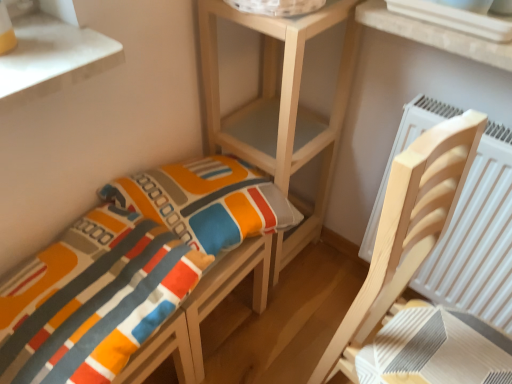
Measure the distance between textured fabric cushion at lower left, acting as the 2th furniture starting from the right, and camera.

The distance of textured fabric cushion at lower left, acting as the 2th furniture starting from the right, from camera is 29.91 inches.

Locate an element on the screen. The width and height of the screenshot is (512, 384). white plastic window at upper right is located at coordinates (434, 35).

From a real-world perspective, does white plastic window at upper right sit lower than light wood chair at right, acting as the 2th furniture starting from the left?

No.

Are white plastic window at upper right and light wood chair at right, the 1th furniture in the right-to-left sequence, located far from each other?

No, white plastic window at upper right is in close proximity to light wood chair at right, the 1th furniture in the right-to-left sequence.

Can you tell me how much white plastic window at upper right and light wood chair at right, acting as the 2th furniture starting from the left, differ in facing direction?

The angular difference between white plastic window at upper right and light wood chair at right, acting as the 2th furniture starting from the left, is 82.4 degrees.

From the picture: Which is nearer, (415, 38) or (448, 223)?

Point (415, 38) is closer to the camera than point (448, 223).

Considering the points (253, 19) and (160, 262), which point is in front, point (253, 19) or point (160, 262)?

The point (160, 262) is closer to the camera.

Can you confirm if wooden shelf at center is thinner than textured fabric cushion at lower left, the 1th furniture in the left-to-right sequence?

Indeed, wooden shelf at center has a lesser width compared to textured fabric cushion at lower left, the 1th furniture in the left-to-right sequence.

Is wooden shelf at center to the left of textured fabric cushion at lower left, the 1th furniture in the left-to-right sequence, from the viewer's perspective?

No, wooden shelf at center is not to the left of textured fabric cushion at lower left, the 1th furniture in the left-to-right sequence.

Considering the sizes of objects wooden shelf at center and white plastic window at upper right in the image provided, who is taller, wooden shelf at center or white plastic window at upper right?

wooden shelf at center is taller.

Which object is thinner, wooden shelf at center or white plastic window at upper right?

wooden shelf at center.

Image resolution: width=512 pixels, height=384 pixels. In order to click on window that appears in front of the wooden shelf at center in this screenshot , I will do `click(434, 35)`.

Considering the relative positions of wooden shelf at center and white plastic window at upper right in the image provided, is wooden shelf at center to the left of white plastic window at upper right from the viewer's perspective?

Correct, you'll find wooden shelf at center to the left of white plastic window at upper right.

Does point (450, 42) come closer to viewer compared to point (183, 167)?

Yes, it is in front of point (183, 167).

Who is smaller, white plastic window at upper right or textured fabric cushion at lower left, the 1th furniture in the left-to-right sequence?

white plastic window at upper right is smaller.

Is white plastic window at upper right shorter than textured fabric cushion at lower left, acting as the 2th furniture starting from the right?

Correct, white plastic window at upper right is not as tall as textured fabric cushion at lower left, acting as the 2th furniture starting from the right.

From a real-world perspective, relative to textured fabric cushion at lower left, the 1th furniture in the left-to-right sequence, is white plastic window at upper right vertically above or below?

white plastic window at upper right is situated higher than textured fabric cushion at lower left, the 1th furniture in the left-to-right sequence, in the real world.

Is textured fabric cushion at lower left, acting as the 2th furniture starting from the right, turned away from light wood chair at right, the 1th furniture in the right-to-left sequence?

No, textured fabric cushion at lower left, acting as the 2th furniture starting from the right, is not facing away from light wood chair at right, the 1th furniture in the right-to-left sequence.

This screenshot has height=384, width=512. I want to click on furniture on the right side of textured fabric cushion at lower left, the 1th furniture in the left-to-right sequence, so [x=406, y=230].

In terms of size, does textured fabric cushion at lower left, the 1th furniture in the left-to-right sequence, appear bigger or smaller than light wood chair at right, the 1th furniture in the right-to-left sequence?

textured fabric cushion at lower left, the 1th furniture in the left-to-right sequence, is smaller than light wood chair at right, the 1th furniture in the right-to-left sequence.

Are textured fabric cushion at lower left, the 1th furniture in the left-to-right sequence, and light wood chair at right, the 1th furniture in the right-to-left sequence, located far from each other?

Actually, textured fabric cushion at lower left, the 1th furniture in the left-to-right sequence, and light wood chair at right, the 1th furniture in the right-to-left sequence, are a little close together.

Does wooden shelf at center appear on the right side of light wood chair at right, the 1th furniture in the right-to-left sequence?

No.

From the image's perspective, would you say wooden shelf at center is shown under light wood chair at right, the 1th furniture in the right-to-left sequence?

No, from the image's perspective, wooden shelf at center is not below light wood chair at right, the 1th furniture in the right-to-left sequence.

Is wooden shelf at center not near light wood chair at right, the 1th furniture in the right-to-left sequence?

No, wooden shelf at center is not far away from light wood chair at right, the 1th furniture in the right-to-left sequence.

Visually, is light wood chair at right, acting as the 2th furniture starting from the left, positioned to the left or to the right of white plastic window at upper right?

From the image, it's evident that light wood chair at right, acting as the 2th furniture starting from the left, is to the left of white plastic window at upper right.

Is point (357, 319) closer to viewer compared to point (443, 36)?

Yes, point (357, 319) is closer to viewer.

Based on the photo, is light wood chair at right, acting as the 2th furniture starting from the left, bigger than white plastic window at upper right?

Correct, light wood chair at right, acting as the 2th furniture starting from the left, is larger in size than white plastic window at upper right.

How different are the orientations of light wood chair at right, the 1th furniture in the right-to-left sequence, and white plastic window at upper right in degrees?

The facing directions of light wood chair at right, the 1th furniture in the right-to-left sequence, and white plastic window at upper right are 82.4 degrees apart.

From the white plastic window at upper right, count 2nd furnitures forward and point to it. Please provide its 2D coordinates.

[(406, 230)]

Identify the location of furniture above the wooden shelf at center (from a real-world perspective). The width and height of the screenshot is (512, 384). (125, 271).

From the image, which object appears to be farther from wooden shelf at center, light wood chair at right, acting as the 2th furniture starting from the left, or white plastic window at upper right?

light wood chair at right, acting as the 2th furniture starting from the left, lies further to wooden shelf at center than the other object.

Considering their positions, is light wood chair at right, the 1th furniture in the right-to-left sequence, positioned closer to wooden shelf at center than textured fabric cushion at lower left, the 1th furniture in the left-to-right sequence?

textured fabric cushion at lower left, the 1th furniture in the left-to-right sequence, lies closer to wooden shelf at center than the other object.

Which object lies further to the anchor point wooden shelf at center, textured fabric cushion at lower left, the 1th furniture in the left-to-right sequence, or light wood chair at right, acting as the 2th furniture starting from the left?

light wood chair at right, acting as the 2th furniture starting from the left.

Which object lies further to the anchor point textured fabric cushion at lower left, acting as the 2th furniture starting from the right, light wood chair at right, acting as the 2th furniture starting from the left, or wooden shelf at center?

light wood chair at right, acting as the 2th furniture starting from the left, lies further to textured fabric cushion at lower left, acting as the 2th furniture starting from the right, than the other object.

Which object lies nearer to the anchor point textured fabric cushion at lower left, the 1th furniture in the left-to-right sequence, light wood chair at right, acting as the 2th furniture starting from the left, or white plastic window at upper right?

light wood chair at right, acting as the 2th furniture starting from the left.

Based on their spatial positions, is wooden shelf at center or white plastic window at upper right closer to textured fabric cushion at lower left, the 1th furniture in the left-to-right sequence?

wooden shelf at center is positioned closer to the anchor textured fabric cushion at lower left, the 1th furniture in the left-to-right sequence.

Estimate the real-world distances between objects in this image. Which object is closer to white plastic window at upper right, light wood chair at right, acting as the 2th furniture starting from the left, or textured fabric cushion at lower left, the 1th furniture in the left-to-right sequence?

The object closer to white plastic window at upper right is light wood chair at right, acting as the 2th furniture starting from the left.

Looking at the image, which one is located further to wooden shelf at center, white plastic window at upper right or light wood chair at right, acting as the 2th furniture starting from the left?

light wood chair at right, acting as the 2th furniture starting from the left.

I want to click on shelf between textured fabric cushion at lower left, the 1th furniture in the left-to-right sequence, and light wood chair at right, acting as the 2th furniture starting from the left, in the horizontal direction, so coord(280,108).

Locate an element on the screen. The image size is (512, 384). shelf between textured fabric cushion at lower left, acting as the 2th furniture starting from the right, and white plastic window at upper right is located at coordinates (280, 108).

The image size is (512, 384). Identify the location of shelf between white plastic window at upper right and light wood chair at right, acting as the 2th furniture starting from the left, in the vertical direction. (280, 108).

At what (x,y) coordinates should I click in order to perform the action: click on furniture situated between textured fabric cushion at lower left, acting as the 2th furniture starting from the right, and white plastic window at upper right from left to right. Please return your answer as a coordinate pair (x, y). Looking at the image, I should click on (406, 230).